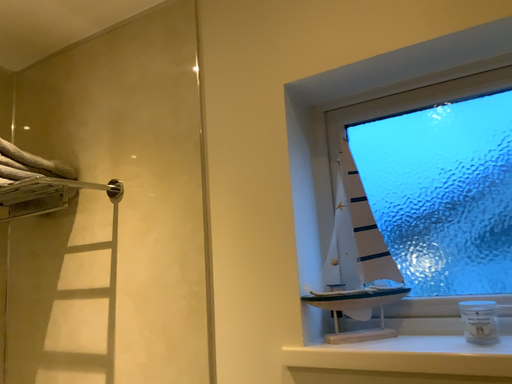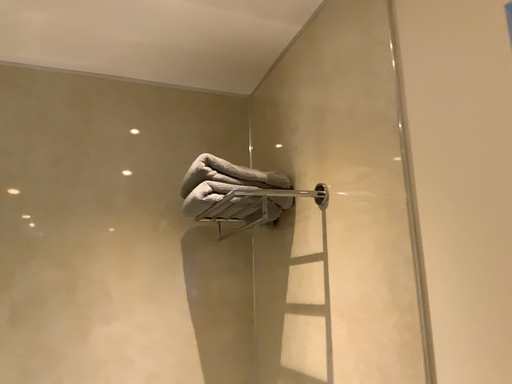
Question: How did the camera likely rotate when shooting the video?

Choices:
 (A) rotated right
 (B) rotated left

Answer: (B)